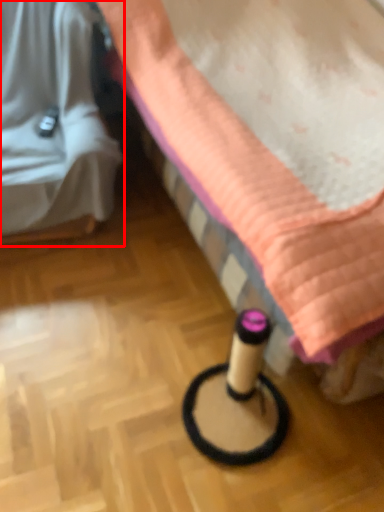
Question: From the image's perspective, considering the relative positions of furniture (annotated by the red box) and furniture in the image provided, where is furniture (annotated by the red box) located with respect to the staircase?

Choices:
 (A) above
 (B) below

Answer: (A)